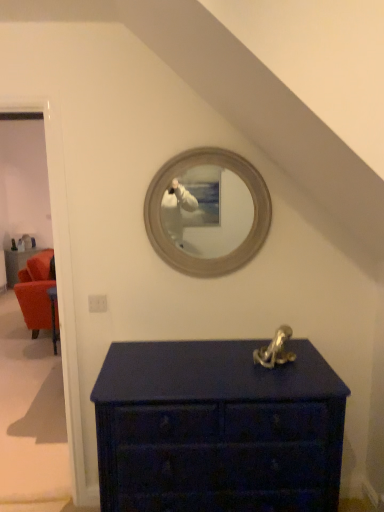
Question: Would you say velvet orange armchair at left is part of matte white door at left's contents?

Choices:
 (A) no
 (B) yes

Answer: (A)

Question: Considering the relative positions of matte white door at left and velvet orange armchair at left in the image provided, is matte white door at left to the right of velvet orange armchair at left from the viewer's perspective?

Choices:
 (A) yes
 (B) no

Answer: (A)

Question: From the image's perspective, is matte white door at left above velvet orange armchair at left?

Choices:
 (A) yes
 (B) no

Answer: (B)

Question: Does matte white door at left come in front of velvet orange armchair at left?

Choices:
 (A) no
 (B) yes

Answer: (B)

Question: Can you confirm if matte white door at left is positioned to the left of velvet orange armchair at left?

Choices:
 (A) no
 (B) yes

Answer: (A)

Question: Considering the positions of velvet orange armchair at left and matte white door at left in the image, is velvet orange armchair at left wider or thinner than matte white door at left?

Choices:
 (A) wide
 (B) thin

Answer: (A)

Question: In terms of height, does velvet orange armchair at left look taller or shorter compared to matte white door at left?

Choices:
 (A) tall
 (B) short

Answer: (B)

Question: From a real-world perspective, is velvet orange armchair at left physically located above or below matte white door at left?

Choices:
 (A) above
 (B) below

Answer: (B)

Question: Looking at the image, does velvet orange armchair at left seem bigger or smaller compared to matte white door at left?

Choices:
 (A) big
 (B) small

Answer: (A)

Question: Looking at the image, does matte white door at left seem bigger or smaller compared to velvet orange armchair at left?

Choices:
 (A) big
 (B) small

Answer: (B)

Question: From the image's perspective, is matte white door at left positioned above or below velvet orange armchair at left?

Choices:
 (A) above
 (B) below

Answer: (B)

Question: Is point (61, 206) closer or farther from the camera than point (9, 274)?

Choices:
 (A) farther
 (B) closer

Answer: (B)

Question: Do you think matte white door at left is within velvet orange armchair at left, or outside of it?

Choices:
 (A) outside
 (B) inside

Answer: (A)

Question: From the image's perspective, is velvet orange armchair at left above or below matte dark blue chest of drawers at lower center?

Choices:
 (A) below
 (B) above

Answer: (B)

Question: In terms of width, does velvet orange armchair at left look wider or thinner when compared to matte dark blue chest of drawers at lower center?

Choices:
 (A) thin
 (B) wide

Answer: (A)